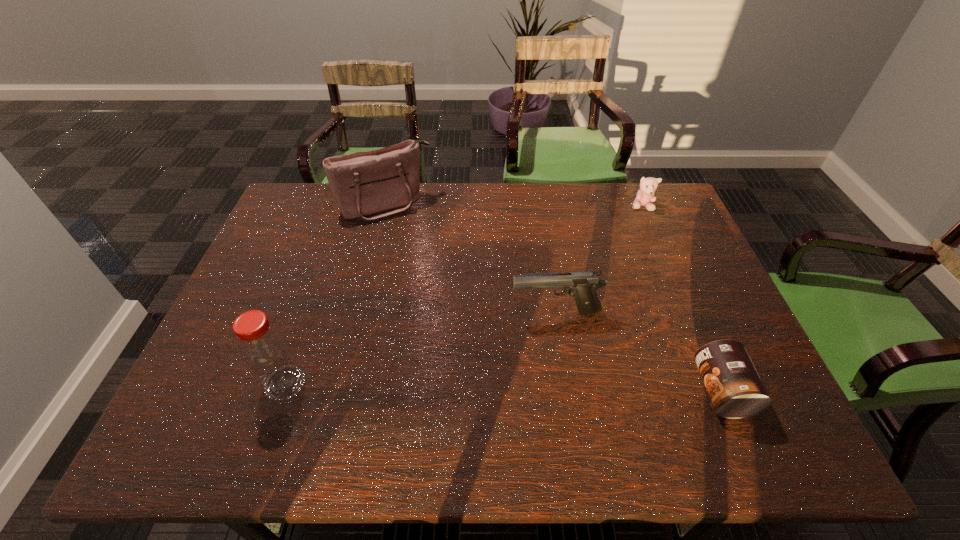
I want to click on vacant space on the desktop that is between the bottle and the can and is positioned at the face of the teddy bear, so click(562, 388).

The image size is (960, 540). What are the coordinates of `free spot on the desktop that is between the bottle and the can and is positioned on the front pocket of the shoulder bag` in the screenshot? It's located at (493, 387).

This screenshot has height=540, width=960. Identify the location of free space on the desktop that is between the bottle and the can and is positioned at the muzzle of the third farthest object. (455, 386).